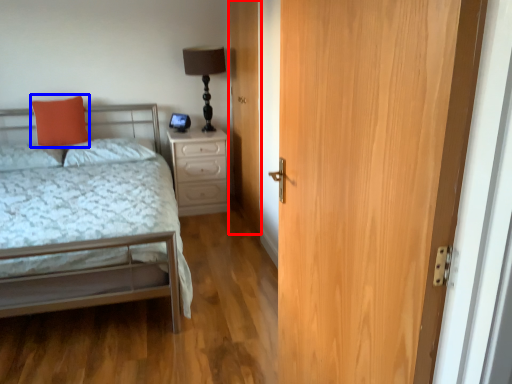
Question: Which object is closer to the camera taking this photo, door (highlighted by a red box) or pillow (highlighted by a blue box)?

Choices:
 (A) door
 (B) pillow

Answer: (A)